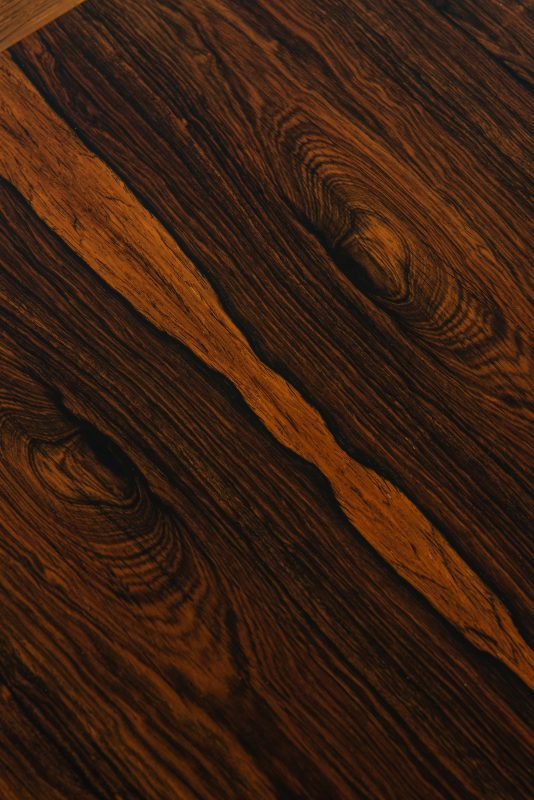
The height and width of the screenshot is (800, 534). I want to click on table, so click(x=87, y=178).